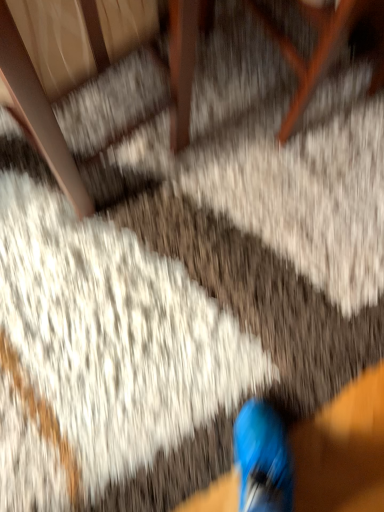
Question: Is wooden chair at upper right further to the viewer compared to wooden armchair at upper left?

Choices:
 (A) no
 (B) yes

Answer: (B)

Question: Is wooden chair at upper right not within wooden armchair at upper left?

Choices:
 (A) yes
 (B) no

Answer: (A)

Question: Is wooden chair at upper right at the left side of wooden armchair at upper left?

Choices:
 (A) no
 (B) yes

Answer: (A)

Question: Is the position of wooden chair at upper right less distant than that of wooden armchair at upper left?

Choices:
 (A) no
 (B) yes

Answer: (A)

Question: From a real-world perspective, is wooden chair at upper right below wooden armchair at upper left?

Choices:
 (A) no
 (B) yes

Answer: (B)

Question: Considering the relative positions of wooden chair at upper right and wooden armchair at upper left in the image provided, is wooden chair at upper right to the right of wooden armchair at upper left from the viewer's perspective?

Choices:
 (A) no
 (B) yes

Answer: (B)

Question: Considering the relative sizes of wooden armchair at upper left and wooden chair at upper right in the image provided, is wooden armchair at upper left taller than wooden chair at upper right?

Choices:
 (A) no
 (B) yes

Answer: (B)

Question: Does wooden armchair at upper left come in front of wooden chair at upper right?

Choices:
 (A) no
 (B) yes

Answer: (B)

Question: From a real-world perspective, is wooden armchair at upper left physically above wooden chair at upper right?

Choices:
 (A) yes
 (B) no

Answer: (A)

Question: Does wooden armchair at upper left contain wooden chair at upper right?

Choices:
 (A) yes
 (B) no

Answer: (B)

Question: Is wooden armchair at upper left turned away from wooden chair at upper right?

Choices:
 (A) no
 (B) yes

Answer: (A)

Question: Is wooden armchair at upper left not within wooden chair at upper right?

Choices:
 (A) yes
 (B) no

Answer: (A)

Question: Relative to wooden chair at upper right, is wooden armchair at upper left in front or behind?

Choices:
 (A) behind
 (B) front

Answer: (B)